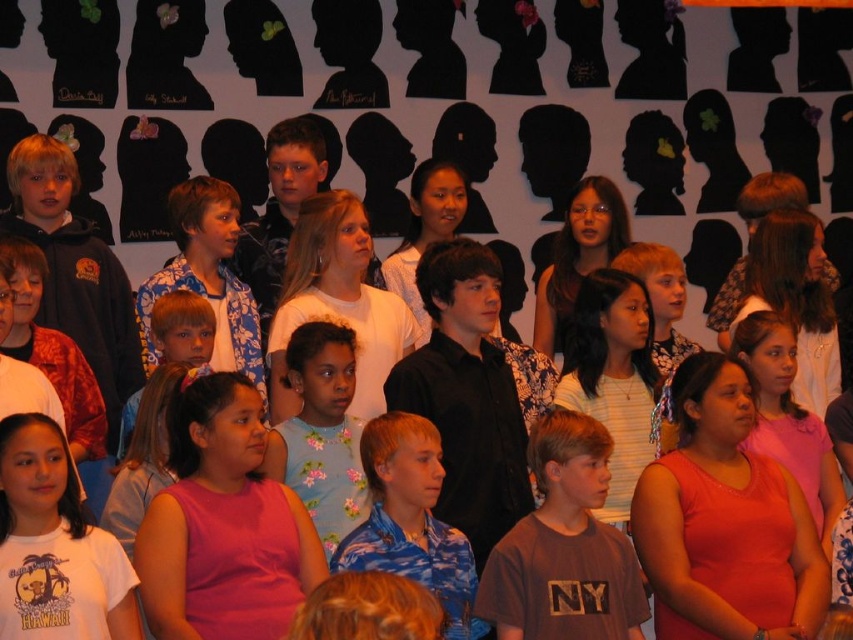
Question: Is brown cotton t-shirt at center below floral fabric dress at center?

Choices:
 (A) yes
 (B) no

Answer: (A)

Question: Which point is farther to the camera?

Choices:
 (A) (300, 401)
 (B) (635, 556)

Answer: (A)

Question: Is brown cotton t-shirt at center below floral fabric dress at center?

Choices:
 (A) no
 (B) yes

Answer: (B)

Question: Which object is farther from the camera taking this photo?

Choices:
 (A) brown cotton t-shirt at center
 (B) floral fabric dress at center

Answer: (B)

Question: Does brown cotton t-shirt at center have a smaller size compared to floral fabric dress at center?

Choices:
 (A) yes
 (B) no

Answer: (B)